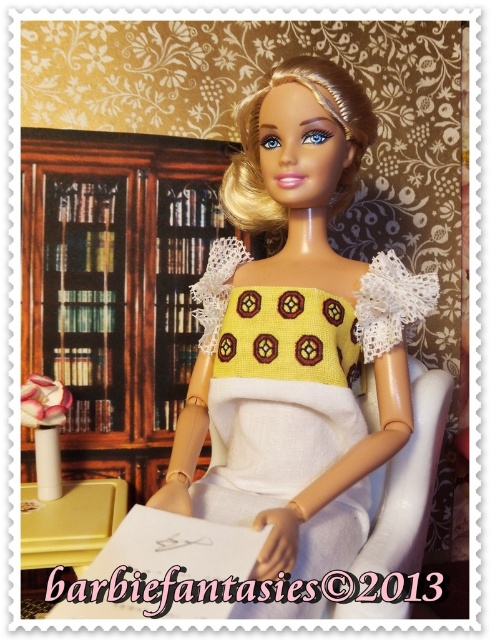
Question: Can you confirm if yellow crochet dress at center is positioned above woodenmaterial/texturebookshelf at left?

Choices:
 (A) no
 (B) yes

Answer: (A)

Question: Which point is closer to the camera?

Choices:
 (A) yellow crochet dress at center
 (B) white fabric chair at center
 (C) woodenmaterial/texturebookshelf at left

Answer: (A)

Question: Is yellow crochet dress at center positioned before yellow knitted dress at center?

Choices:
 (A) yes
 (B) no

Answer: (B)

Question: Among these points, which one is nearest to the camera?

Choices:
 (A) (271, 436)
 (B) (373, 355)
 (C) (59, 326)
 (D) (395, 508)

Answer: (A)

Question: Does yellow knitted dress at center come behind white fabric chair at center?

Choices:
 (A) yes
 (B) no

Answer: (B)

Question: Which point appears farthest from the camera in this image?

Choices:
 (A) pos(311,428)
 (B) pos(414,476)
 (C) pos(285,564)
 (D) pos(62,131)

Answer: (D)